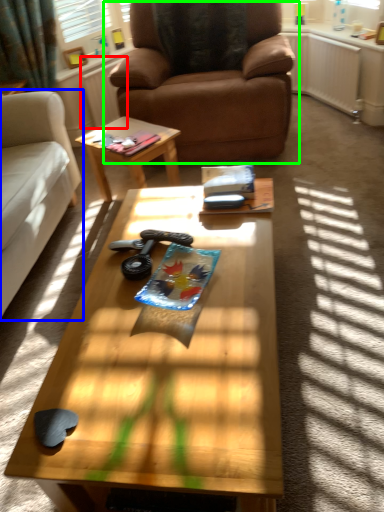
Question: Which is farther away from radiator (highlighted by a red box)? studio couch (highlighted by a blue box) or chair (highlighted by a green box)?

Choices:
 (A) studio couch
 (B) chair

Answer: (A)